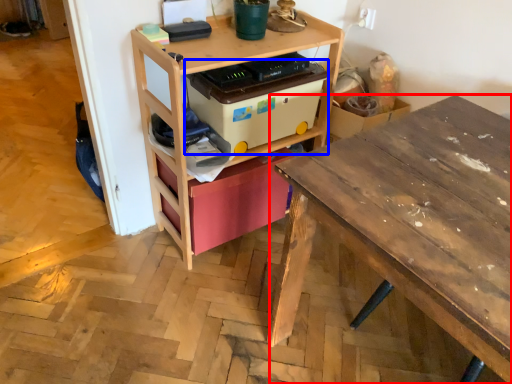
Question: Which of the following is the farthest to the observer, desk (highlighted by a red box) or storage box (highlighted by a blue box)?

Choices:
 (A) desk
 (B) storage box

Answer: (B)